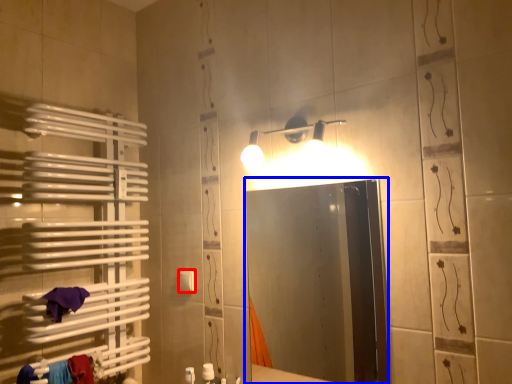
Question: Which of the following is the farthest to the observer, towel bar (highlighted by a red box) or mirror (highlighted by a blue box)?

Choices:
 (A) towel bar
 (B) mirror

Answer: (A)